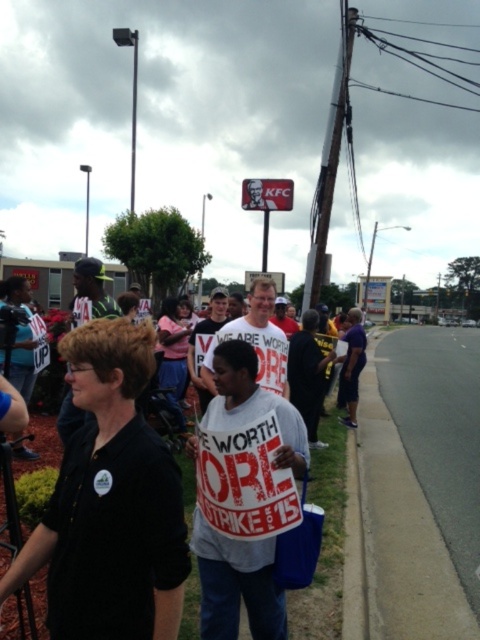
Can you confirm if black shirt at center is positioned below white cotton shirt at center?

No.

Which is behind, point (156, 568) or point (324, 465)?

Point (324, 465)

In order to click on black shirt at center in this screenshot , I will do `click(110, 502)`.

At what (x,y) coordinates should I click in order to perform the action: click on black shirt at center. Please return your answer as a coordinate pair (x, y). The height and width of the screenshot is (640, 480). Looking at the image, I should click on (110, 502).

Who is higher up, white paper sign at center or white cotton shirt at center?

white paper sign at center is above.

Can you confirm if white paper sign at center is positioned to the right of white cotton shirt at center?

Yes, white paper sign at center is to the right of white cotton shirt at center.

Who is more forward, (229, 554) or (315, 465)?

Point (229, 554)

The image size is (480, 640). I want to click on white paper sign at center, so click(x=237, y=584).

In the scene shown: Who is higher up, black shirt at center or white paper sign at center?

Positioned higher is black shirt at center.

Based on the photo, who is more forward, (49, 540) or (254, 572)?

Point (49, 540) is more forward.

This screenshot has width=480, height=640. What are the coordinates of `black shirt at center` in the screenshot? It's located at (110, 502).